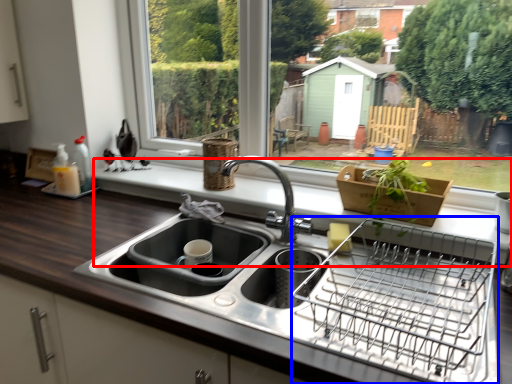
Question: Which point is closer to the camera, window sill (highlighted by a red box) or appliance (highlighted by a blue box)?

Choices:
 (A) window sill
 (B) appliance

Answer: (B)